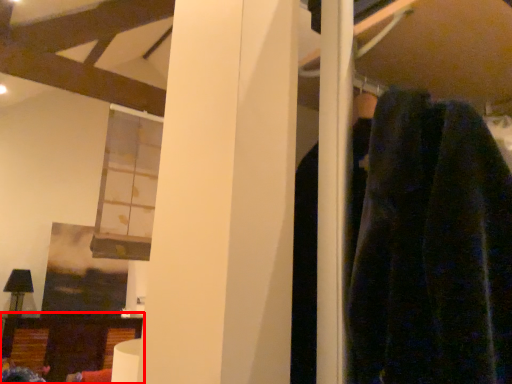
Question: From the image's perspective, where is furniture (annotated by the red box) located relative to window?

Choices:
 (A) above
 (B) below

Answer: (B)